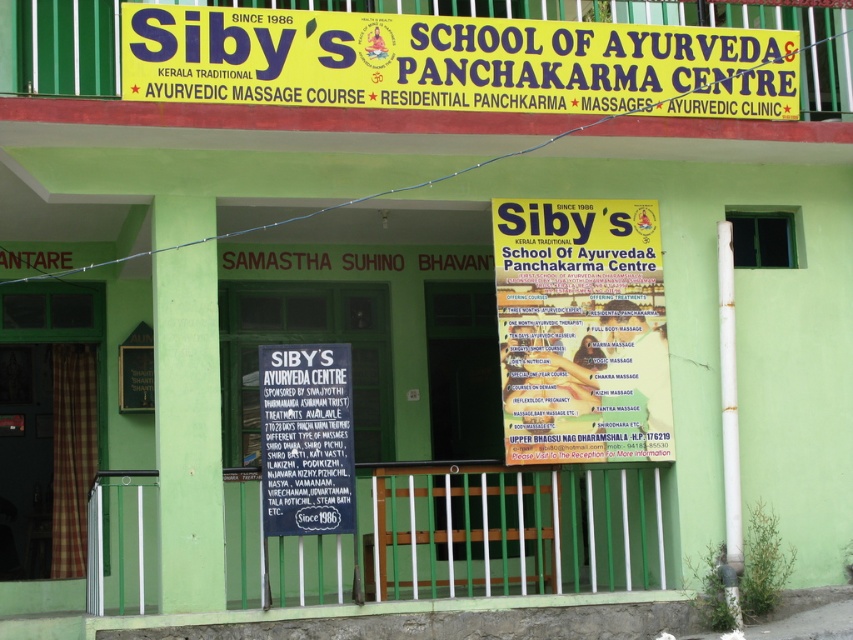
Between yellow paper flyer at center and black paper sign at center, which one appears on the left side from the viewer's perspective?

black paper sign at center

Is yellow paper flyer at center positioned behind black paper sign at center?

Yes.

Between point (659, 332) and point (328, 355), which one is positioned in front?

Point (328, 355) is in front.

The height and width of the screenshot is (640, 853). I want to click on yellow paper flyer at center, so click(581, 330).

Does yellow paper flyer at center come in front of matte black signboard at center?

Yes, yellow paper flyer at center is in front of matte black signboard at center.

Between point (633, 342) and point (140, 360), which one is positioned behind?

The point (140, 360) is behind.

Find the location of a particular element. yellow paper flyer at center is located at coordinates (581, 330).

Does yellow/yellowish paper sign at upper center appear on the left side of black paper sign at center?

Incorrect, yellow/yellowish paper sign at upper center is not on the left side of black paper sign at center.

Is the position of yellow/yellowish paper sign at upper center more distant than that of black paper sign at center?

No, yellow/yellowish paper sign at upper center is in front of black paper sign at center.

Identify the location of yellow/yellowish paper sign at upper center. This screenshot has height=640, width=853. (454, 61).

Identify the location of yellow/yellowish paper sign at upper center. (454, 61).